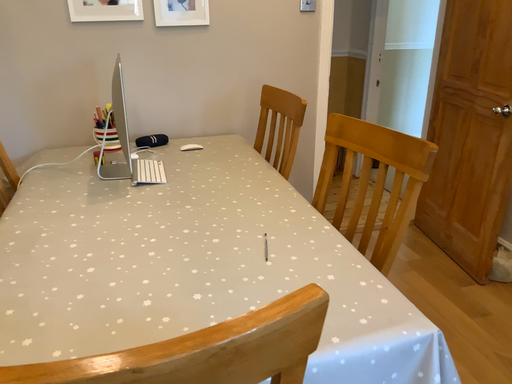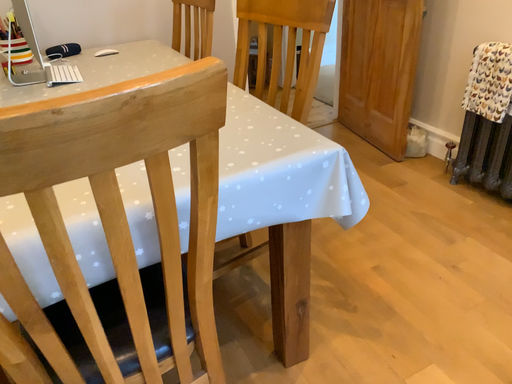
Question: Which way did the camera rotate in the video?

Choices:
 (A) rotated right
 (B) rotated left

Answer: (A)